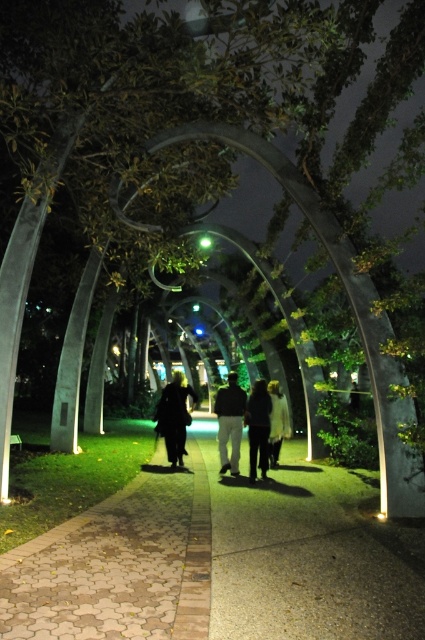
You are standing at the entrance of the pathway in the park. You want to walk towards the brown cobblestone pavement at center. Which direction should you head?

The brown cobblestone pavement at center is located at point coordinates, so you should head towards the center of the pathway to reach it.

In the scene shown: You are a photographer standing at the entrance of the archway path. You notice the brown cobblestone pavement at center and the black matte coat at center. Which object is closer to you, the photographer?

The brown cobblestone pavement at center is positioned over the black matte coat at center, meaning it is closer to you.

In the scene shown: You are a photographer standing at the entrance of the archway path. You want to capture a photo of the dark gray fabric pants at center and dark fabric pants at center in the same frame. Given that your camera has a maximum focus range of 20 inches, will both subjects be in focus?

The distance between the dark gray fabric pants at center and dark fabric pants at center is 21.44 inches, which exceeds the camera focus range of 20 inches. Therefore, both subjects cannot be in focus simultaneously.